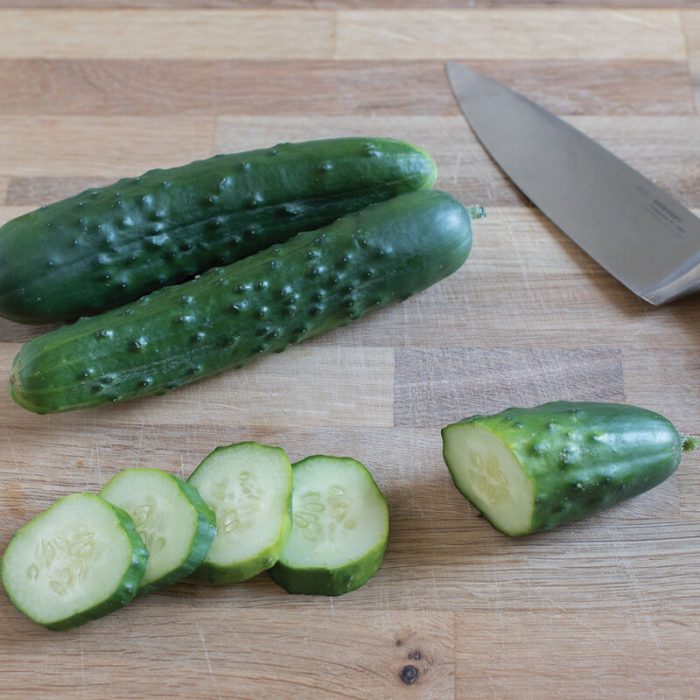
Locate an element on the screen. This screenshot has width=700, height=700. planks of surface is located at coordinates (468, 362).